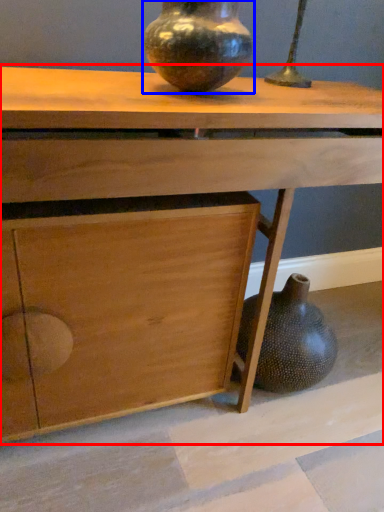
Question: Which point is further to the camera, table (highlighted by a red box) or vase (highlighted by a blue box)?

Choices:
 (A) table
 (B) vase

Answer: (B)